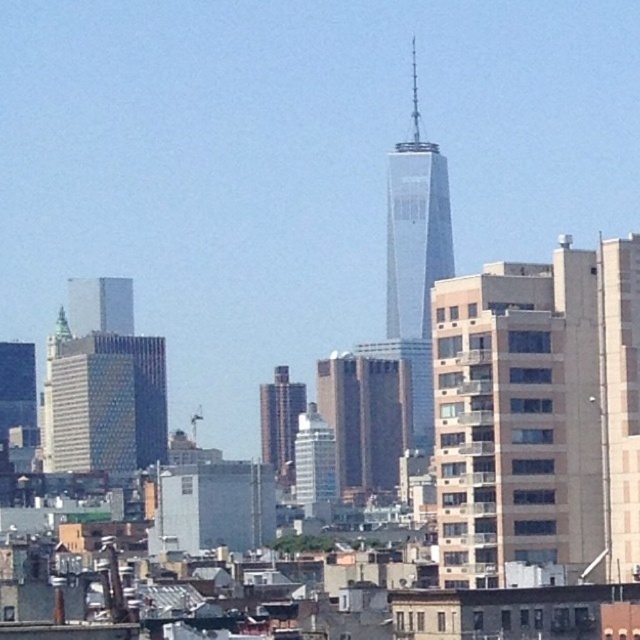
Between matte glass skyscraper at left and white glossy building at center, which one is positioned higher?

matte glass skyscraper at left is higher up.

What are the coordinates of `matte glass skyscraper at left` in the screenshot? It's located at (104, 385).

This screenshot has width=640, height=640. What are the coordinates of `matte glass skyscraper at left` in the screenshot? It's located at (x=104, y=385).

Can you confirm if beige concrete building at right is bigger than matte glass skyscraper at left?

Indeed, beige concrete building at right has a larger size compared to matte glass skyscraper at left.

Between beige concrete building at right and matte glass skyscraper at left, which one appears on the right side from the viewer's perspective?

From the viewer's perspective, beige concrete building at right appears more on the right side.

Who is more distant from viewer, (515, 444) or (92, 449)?

The point (92, 449) is more distant.

I want to click on beige concrete building at right, so click(x=538, y=413).

Who is more distant from viewer, (141, 336) or (400, 212)?

The point (141, 336) is behind.

This screenshot has height=640, width=640. Identify the location of matte glass skyscraper at left. (104, 385).